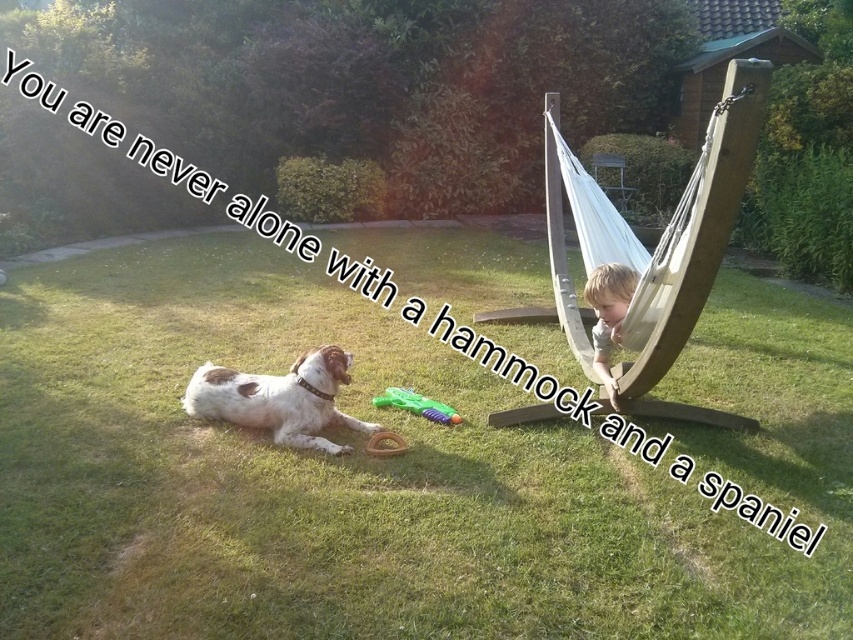
Which is behind, point (593, 355) or point (383, 401)?

Positioned behind is point (593, 355).

Who is lower down, light brown hair at hammock or green plastic brush at lower center?

green plastic brush at lower center

Who is more forward, (612,401) or (424,396)?

Point (612,401) is in front.

The image size is (853, 640). I want to click on light brown hair at hammock, so click(x=608, y=316).

Who is lower down, green grass at lower left or green plastic brush at lower center?

green plastic brush at lower center

Which of these two, green grass at lower left or green plastic brush at lower center, stands taller?

With more height is green plastic brush at lower center.

You are a GUI agent. You are given a task and a screenshot of the screen. Output one action in this format:
    pyautogui.click(x=<x>, y=<y>)
    Task: Click on the green grass at lower left
    
    Given the screenshot: What is the action you would take?
    pyautogui.click(x=396, y=461)

Is speckled fur dog at lower left bigger than light brown hair at hammock?

Correct, speckled fur dog at lower left is larger in size than light brown hair at hammock.

Measure the distance from speckled fur dog at lower left to light brown hair at hammock.

The distance of speckled fur dog at lower left from light brown hair at hammock is 1.65 meters.

Find the location of `speckled fur dog at lower left`. speckled fur dog at lower left is located at coordinates (277, 397).